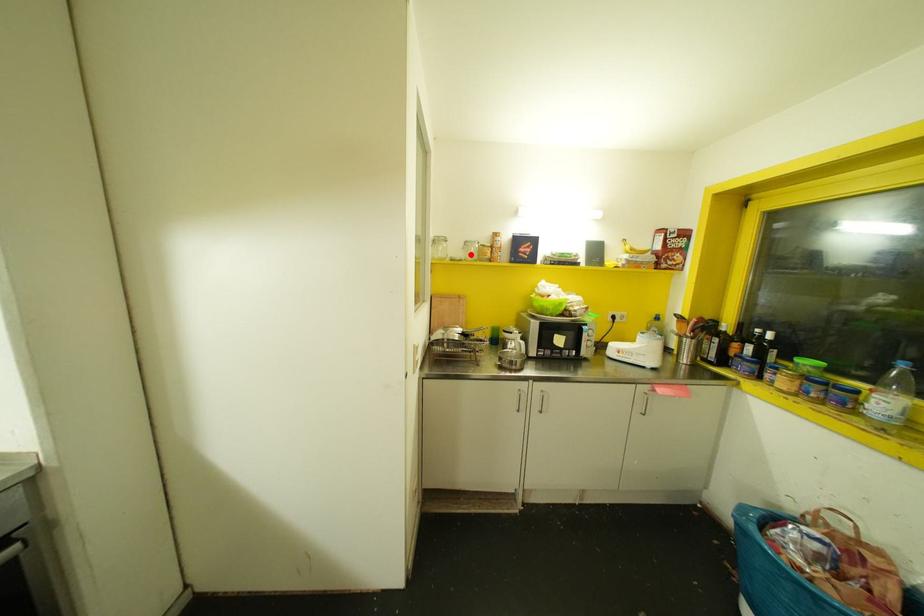
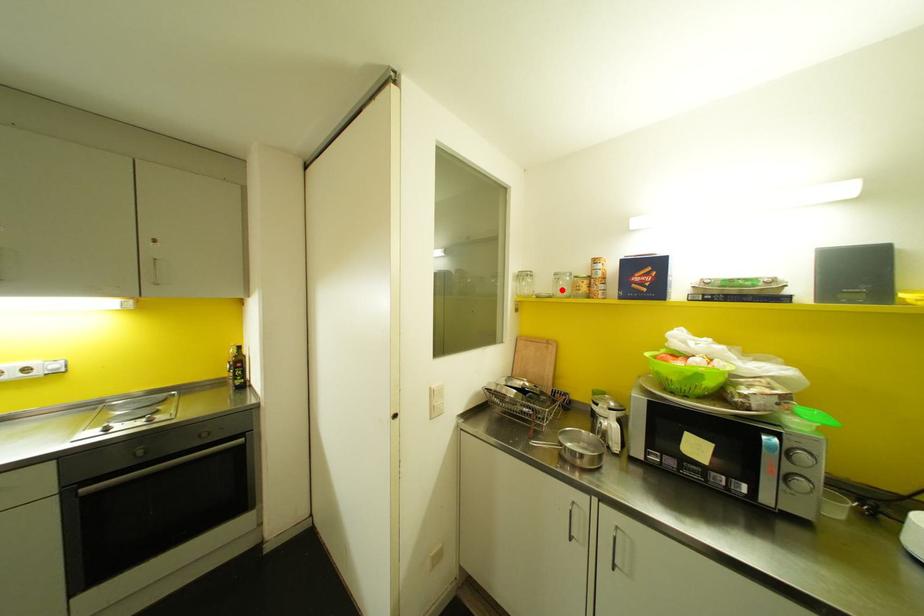
I am providing you with two images of the same scene from different viewpoints. A red point is marked on the first image and another point is marked on the second image. Do the highlighted points in image1 and image2 indicate the same real-world spot?

Yes